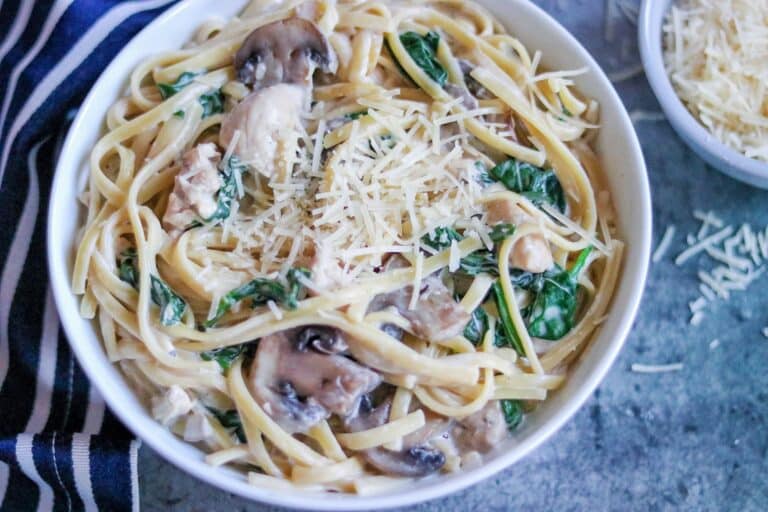
The height and width of the screenshot is (512, 768). In order to click on napkin in this screenshot , I will do `click(50, 70)`.